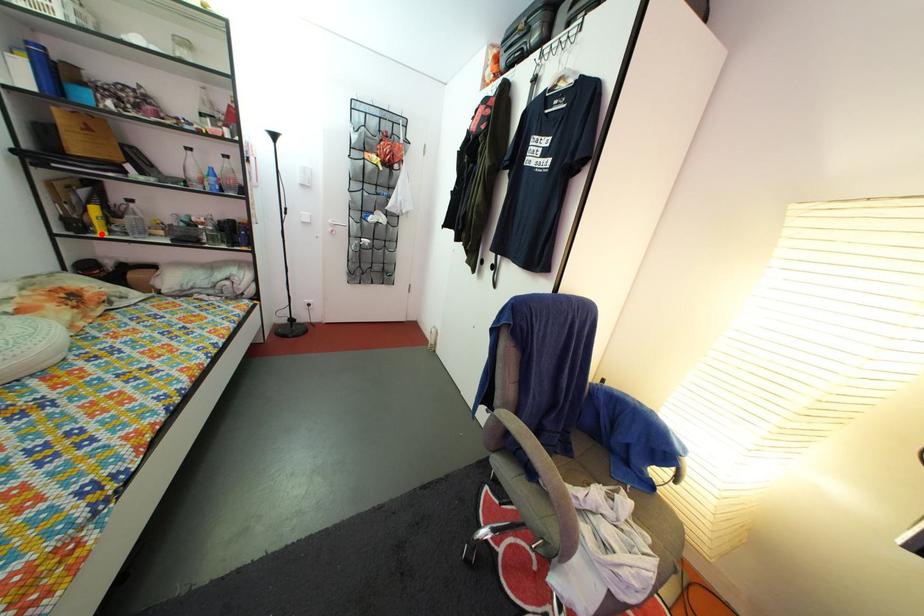
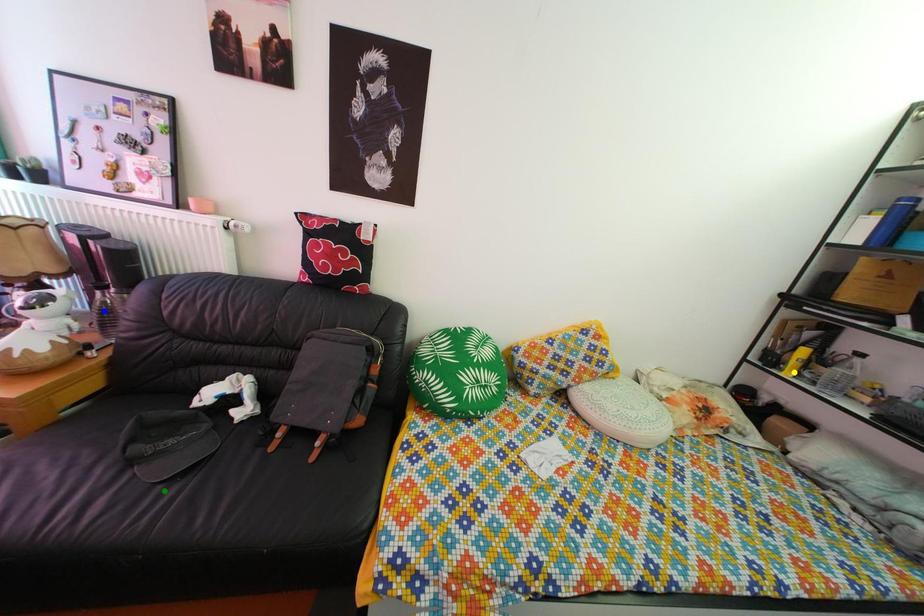
Question: I am providing you with two images of the same scene from different viewpoints. A red point is marked on the first image. You are given multiple points on the second image. Which spot in image 2 lines up with the point in image 1?

Choices:
 (A) blue point
 (B) yellow point
 (C) green point

Answer: (B)